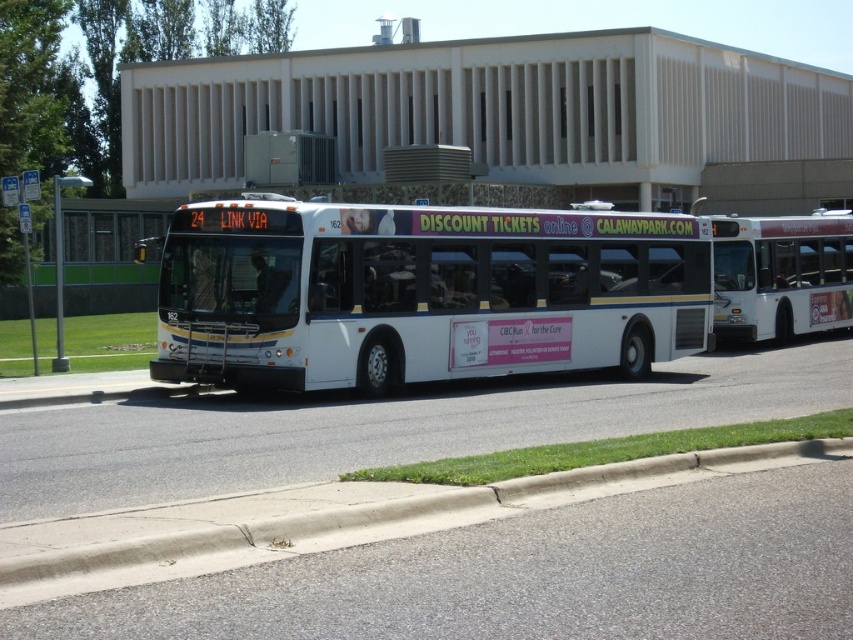
Based on the photo, you are standing on the sidewalk and want to cross the street where the bus is currently located. The curb you need to reach is the gray concrete curb at lower center. According to the image, where exactly is this curb located?

The gray concrete curb at lower center is located at point [325,518].

You are a delivery person trying to load a tall package onto your truck parked behind the white matte bus at center. The truck has a height restriction of 2 meters. Can the gray concrete curb at lower center block the loading process?

The white matte bus at center is much taller than the gray concrete curb at lower center. Since the bus is taller, the curb is not tall enough to block the loading of the package onto the truck, so it won